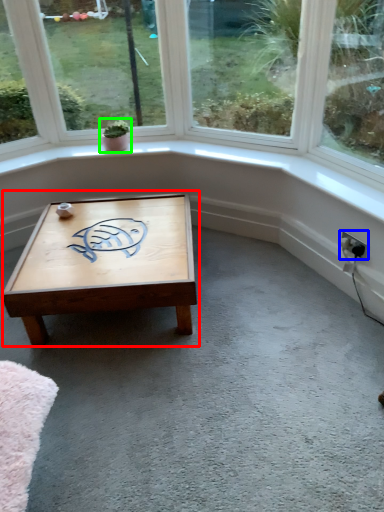
Question: Based on their relative distances, which object is nearer to coffee table (highlighted by a red box)? Choose from electric outlet (highlighted by a blue box) and houseplant (highlighted by a green box).

Choices:
 (A) electric outlet
 (B) houseplant

Answer: (B)